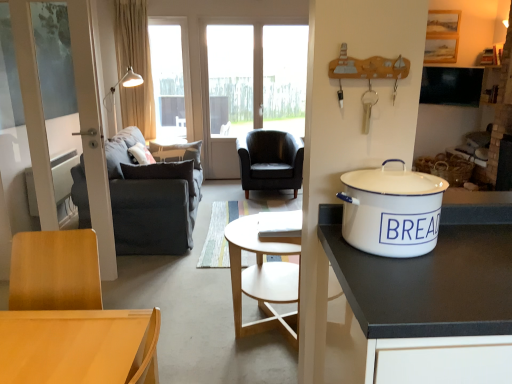
Locate an element on the screen. free space above transparent glass window at upper center (from a real-world perspective) is located at coordinates tap(168, 20).